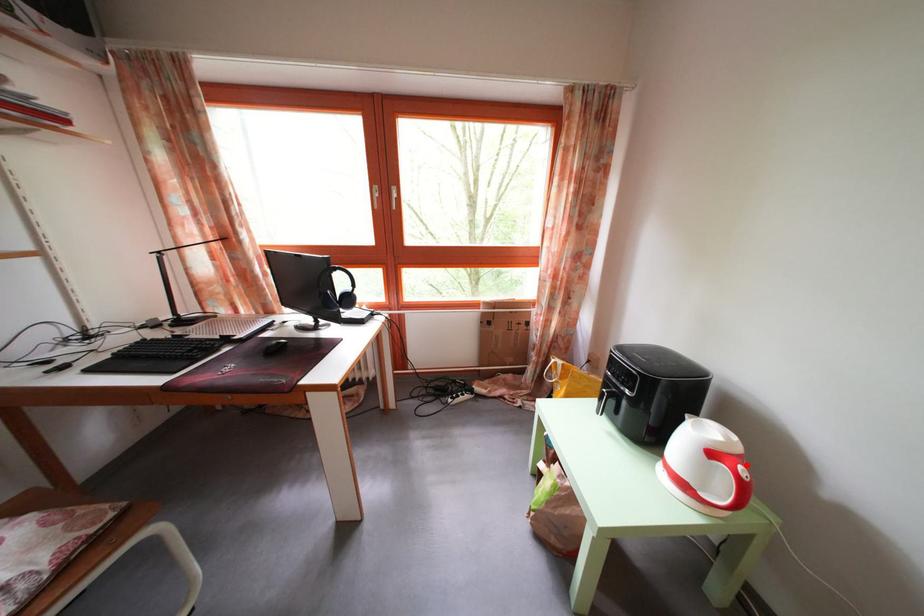
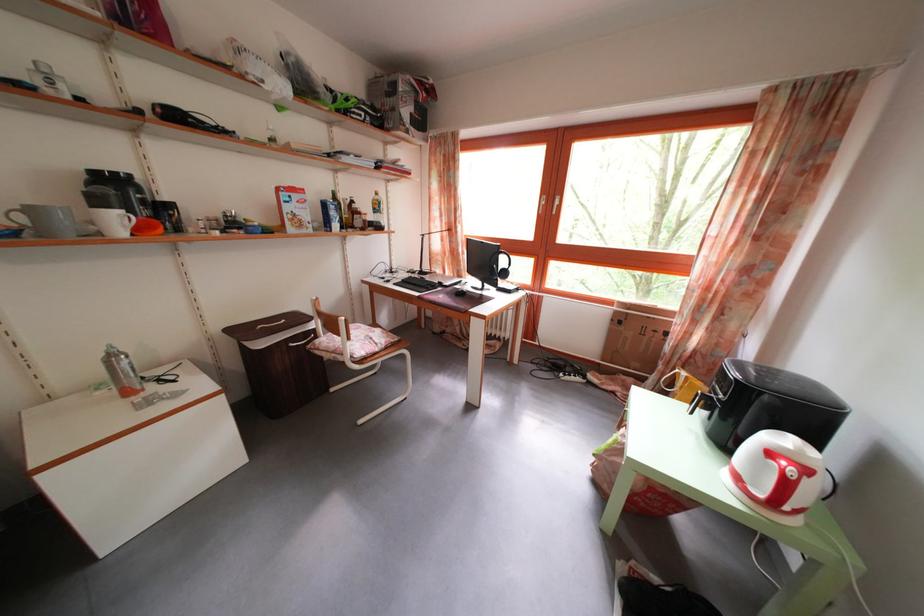
The point at the highlighted location is marked in the first image. Where is the corresponding point in the second image?

(812, 477)